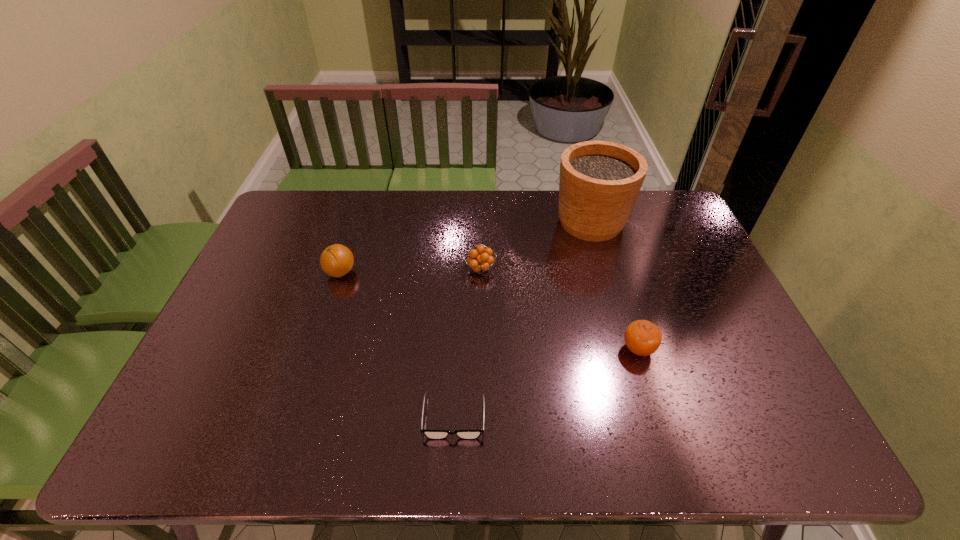
You are a GUI agent. You are given a task and a screenshot of the screen. Output one action in this format:
    pyautogui.click(x=<x>, y=<y>)
    Task: Click on the free area in between the spectacles and the rightmost orange fruit
    
    Given the screenshot: What is the action you would take?
    pyautogui.click(x=546, y=383)

The height and width of the screenshot is (540, 960). I want to click on object that stands as the fourth closest to the flowerpot, so click(x=337, y=260).

Where is `the second closest object to the rightmost orange fruit`? the second closest object to the rightmost orange fruit is located at coordinates (430, 434).

Find the location of a particular element. The height and width of the screenshot is (540, 960). orange fruit that is the closest one to the leftmost orange fruit is located at coordinates (480, 263).

At what (x,y) coordinates should I click in order to perform the action: click on orange fruit that is the nearest to the second shortest object. Please return your answer as a coordinate pair (x, y). The image size is (960, 540). Looking at the image, I should click on (337, 260).

Locate an element on the screen. This screenshot has width=960, height=540. free spot that satisfies the following two spatial constraints: 1. on the front side of the farthest object; 2. on the right side of the second nearest object is located at coordinates (627, 349).